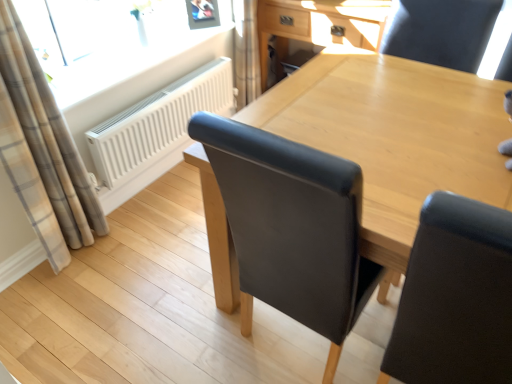
Question: From a real-world perspective, is plaid fabric curtain at left positioned above or below light brown wood table at center?

Choices:
 (A) below
 (B) above

Answer: (B)

Question: Is plaid fabric curtain at left bigger or smaller than light brown wood table at center?

Choices:
 (A) small
 (B) big

Answer: (A)

Question: Which object is positioned closest to the metallic silver picture frame at upper center?

Choices:
 (A) plaid fabric curtain at left
 (B) black leather chair at upper right
 (C) light wood/texture computer desk at upper center
 (D) white matte radiator at upper left
 (E) transparent glass window at upper left

Answer: (E)

Question: Which is farther from the transparent glass window at upper left?

Choices:
 (A) black leather chair at upper right
 (B) light brown wood table at center
 (C) white matte radiator at upper left
 (D) plaid fabric curtain at left
 (E) metallic silver picture frame at upper center

Answer: (A)